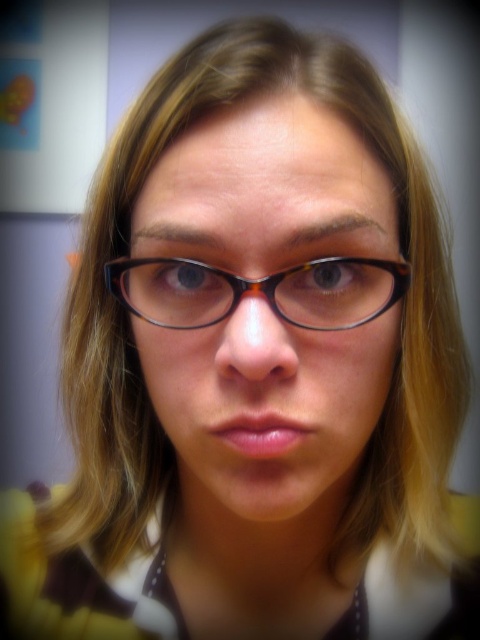
Looking at this image, you are a photographer adjusting the focus on your camera. You notice two pairs of glasses in the image, the black tortoiseshell glasses at center and the tortoiseshell frame glasses at center. Which pair of glasses is larger in height?

The black tortoiseshell glasses at center has a greater height compared to the tortoiseshell frame glasses at center, so the black tortoiseshell glasses at center is larger in height.